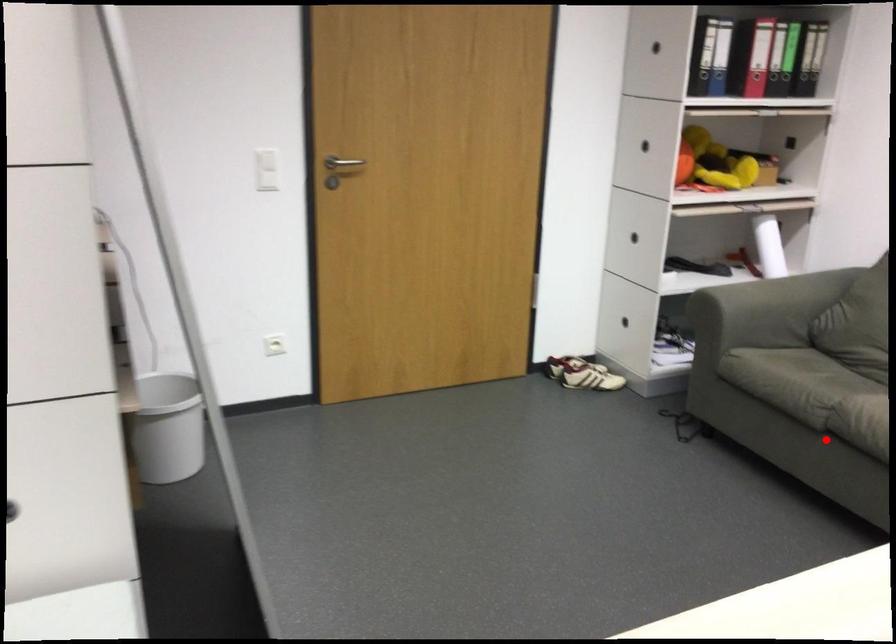
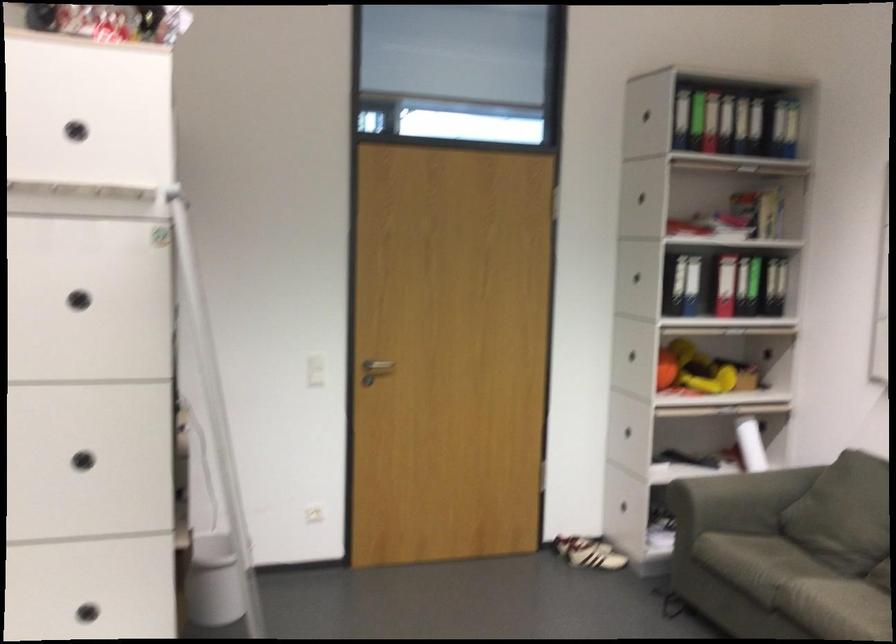
The point at the highlighted location is marked in the first image. Where is the corresponding point in the second image?

(771, 623)